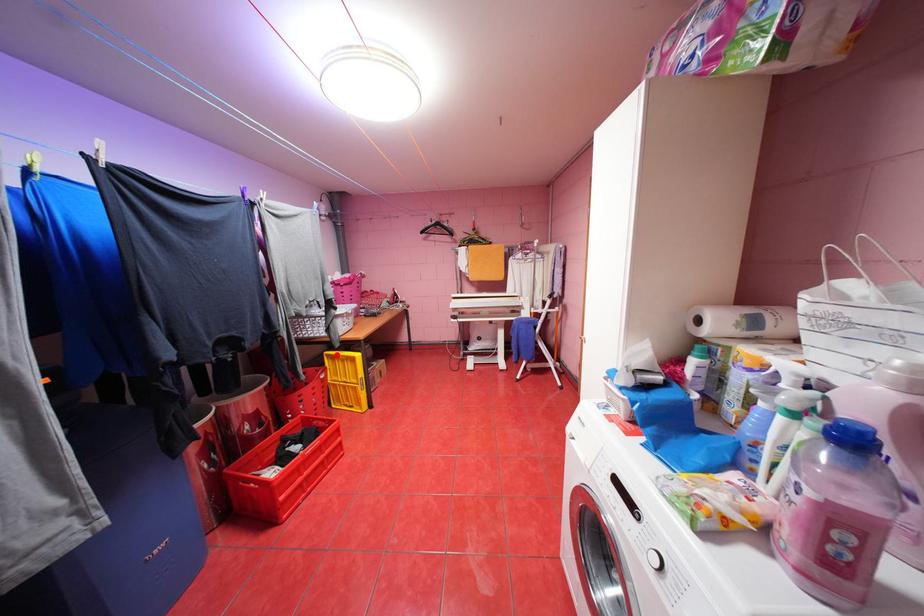
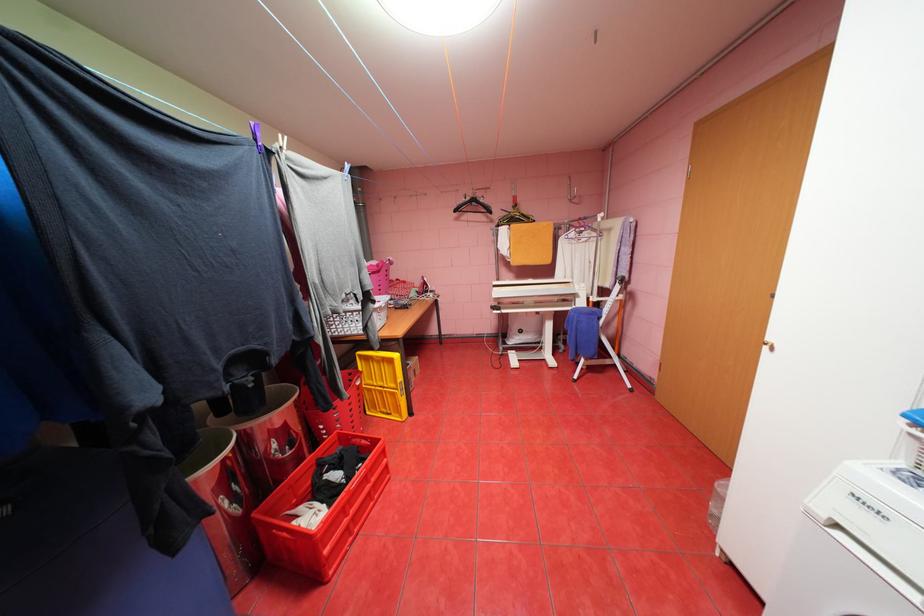
In the second image, find the point that corresponds to the highlighted location in the first image.

(370, 355)